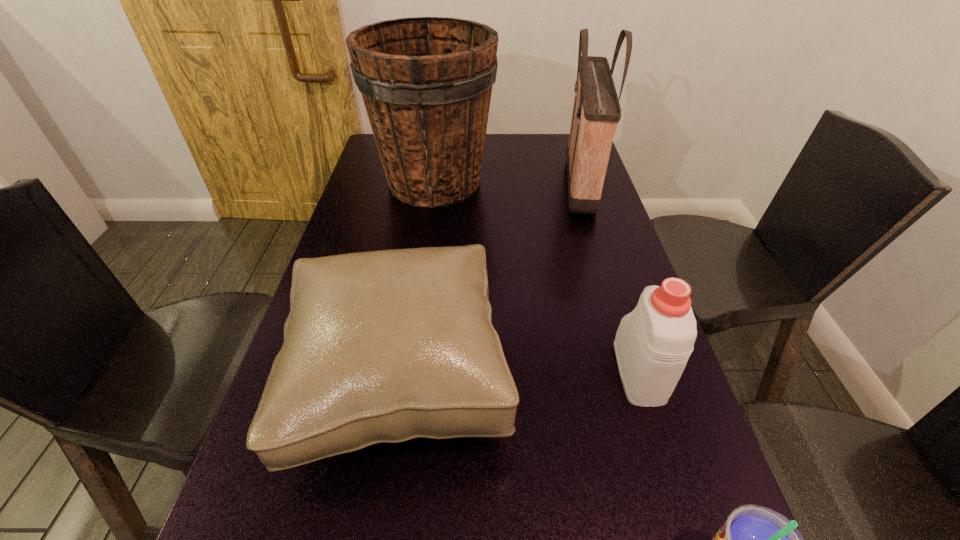
I want to click on shopping bag, so click(596, 113).

The image size is (960, 540). I want to click on bucket, so click(426, 82).

In order to click on cushion in this screenshot , I will do `click(381, 346)`.

This screenshot has width=960, height=540. I want to click on detergent, so click(653, 343).

Identify the location of vacant space located on the left of the shopping bag. [x=487, y=184].

Where is `blank space located on the front of the bucket`? The width and height of the screenshot is (960, 540). blank space located on the front of the bucket is located at coordinates (417, 309).

Image resolution: width=960 pixels, height=540 pixels. In order to click on blank space located 0.130m on the back of the cushion in this screenshot , I will do `click(419, 265)`.

This screenshot has height=540, width=960. Identify the location of free space located 0.100m on the handle side of the detergent. click(618, 305).

You are a GUI agent. You are given a task and a screenshot of the screen. Output one action in this format:
    pyautogui.click(x=<x>, y=<y>)
    Task: Click on the blank space located 0.240m on the handle side of the detergent
    The width and height of the screenshot is (960, 540).
    Given the screenshot: What is the action you would take?
    pyautogui.click(x=606, y=266)

Identify the location of vacant space located on the handle side of the detergent. (613, 291).